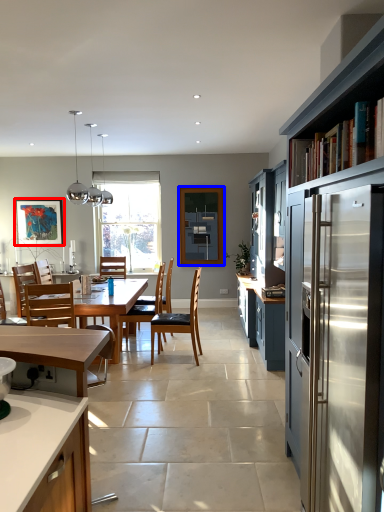
Question: Which of the following is the farthest to the observer, picture frame (highlighted by a red box) or window screen (highlighted by a blue box)?

Choices:
 (A) picture frame
 (B) window screen

Answer: (A)